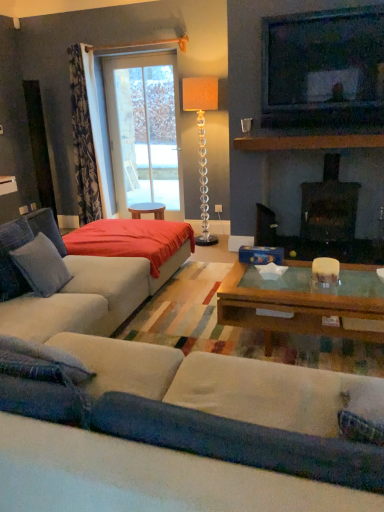
Question: From the image's perspective, does red fabric bed at center appear higher than matte black television at upper right?

Choices:
 (A) yes
 (B) no

Answer: (B)

Question: Can you confirm if red fabric bed at center is taller than matte black television at upper right?

Choices:
 (A) no
 (B) yes

Answer: (A)

Question: Is red fabric bed at center positioned behind matte black television at upper right?

Choices:
 (A) yes
 (B) no

Answer: (B)

Question: Is red fabric bed at center oriented away from matte black television at upper right?

Choices:
 (A) no
 (B) yes

Answer: (A)

Question: Could matte black television at upper right be considered to be inside red fabric bed at center?

Choices:
 (A) yes
 (B) no

Answer: (B)

Question: Is red fabric bed at center taller or shorter than transparent glass door at upper center?

Choices:
 (A) short
 (B) tall

Answer: (A)

Question: Is red fabric bed at center inside or outside of transparent glass door at upper center?

Choices:
 (A) inside
 (B) outside

Answer: (B)

Question: From a real-world perspective, is red fabric bed at center physically located above or below transparent glass door at upper center?

Choices:
 (A) below
 (B) above

Answer: (A)

Question: From the image's perspective, is red fabric bed at center located above or below transparent glass door at upper center?

Choices:
 (A) below
 (B) above

Answer: (A)

Question: Based on their positions, is brown wooden mantle at upper center located to the left or right of black glass fireplace at center?

Choices:
 (A) right
 (B) left

Answer: (B)

Question: From their relative heights in the image, would you say brown wooden mantle at upper center is taller or shorter than black glass fireplace at center?

Choices:
 (A) tall
 (B) short

Answer: (B)

Question: From a real-world perspective, is brown wooden mantle at upper center positioned above or below black glass fireplace at center?

Choices:
 (A) above
 (B) below

Answer: (A)

Question: Considering the positions of brown wooden mantle at upper center and black glass fireplace at center in the image, is brown wooden mantle at upper center wider or thinner than black glass fireplace at center?

Choices:
 (A) thin
 (B) wide

Answer: (A)

Question: Is point (339, 209) positioned closer to the camera than point (46, 237)?

Choices:
 (A) farther
 (B) closer

Answer: (A)

Question: Is black glass fireplace at center inside or outside of soft gray fabric pillow at left?

Choices:
 (A) outside
 (B) inside

Answer: (A)